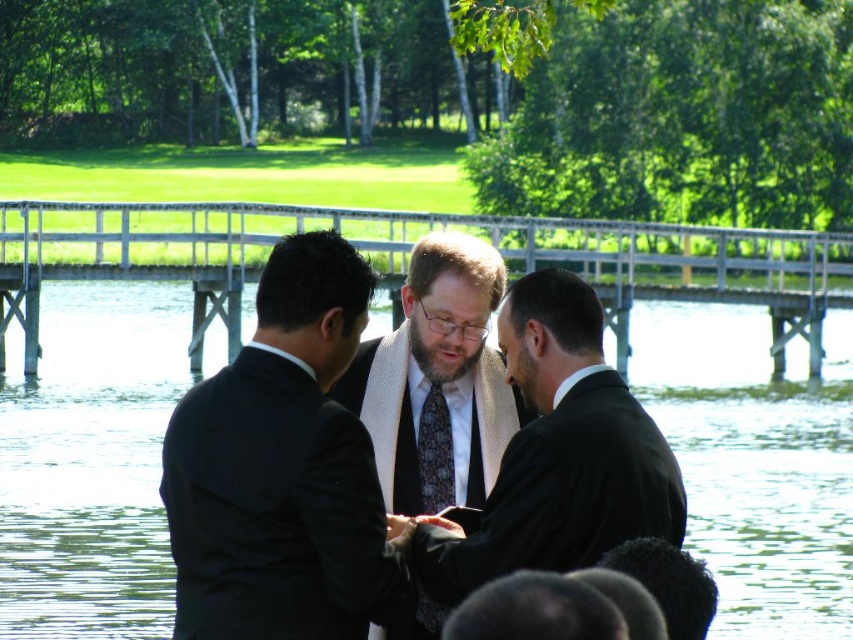
Locate an element on the screen. This screenshot has width=853, height=640. matte black suit at center is located at coordinates (556, 454).

Describe the element at coordinates (556, 454) in the screenshot. I see `matte black suit at center` at that location.

Does point (515, 484) lie behind point (428, 454)?

That is False.

The width and height of the screenshot is (853, 640). Identify the location of matte black suit at center. (556, 454).

Is black suit at center above matte black suit at center?

Indeed, black suit at center is positioned over matte black suit at center.

Is black suit at center in front of matte black suit at center?

Yes.

Is point (175, 476) positioned in front of point (575, 481)?

That is True.

The width and height of the screenshot is (853, 640). Identify the location of black suit at center. (282, 468).

Is white wooden dock at center positioned in front of patterned silk tie at center?

No, white wooden dock at center is further to the viewer.

Identify the location of white wooden dock at center. The width and height of the screenshot is (853, 640). (408, 257).